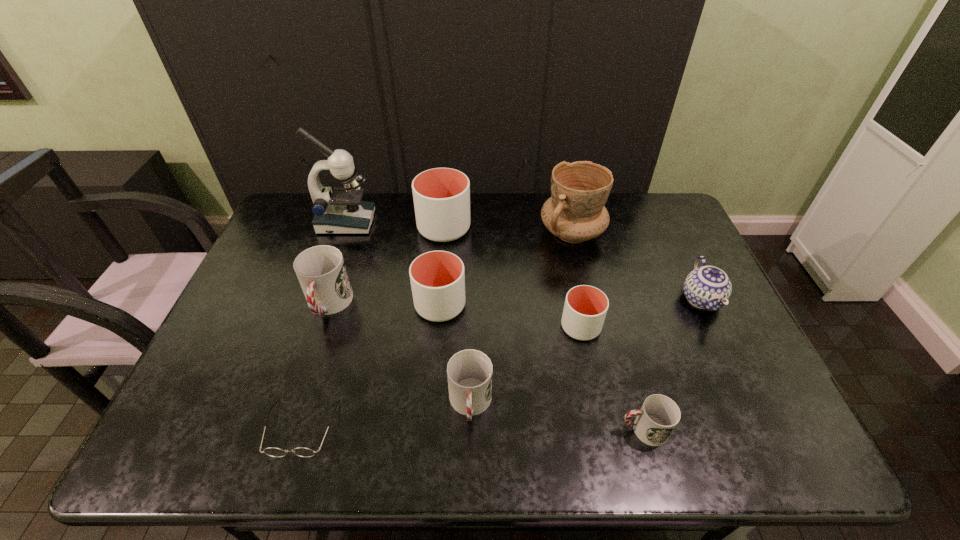
This screenshot has width=960, height=540. Identify the location of spectacles that is at the near edge. (271, 451).

Identify the location of object situated at the left edge. This screenshot has height=540, width=960. (340, 211).

This screenshot has height=540, width=960. What are the coordinates of `object located at the right edge` in the screenshot? It's located at (707, 287).

This screenshot has width=960, height=540. In order to click on object located at the far left corner in this screenshot , I will do `click(340, 211)`.

Identify the location of free space at the far edge of the desktop. This screenshot has height=540, width=960. (535, 231).

The height and width of the screenshot is (540, 960). Find the location of `vacant region at the left edge of the desktop`. vacant region at the left edge of the desktop is located at coordinates (257, 378).

In the image, there is a desktop. What are the coordinates of `vacant space at the right edge` in the screenshot? It's located at (688, 257).

Where is `free space at the far left corner of the desktop`? free space at the far left corner of the desktop is located at coordinates (296, 201).

You are a GUI agent. You are given a task and a screenshot of the screen. Output one action in this format:
    pyautogui.click(x=<x>, y=<y>)
    Task: Click on the free location at the near left corner
    
    Given the screenshot: What is the action you would take?
    pyautogui.click(x=196, y=456)

Find the location of a particular element. free spot at the near right corner of the desktop is located at coordinates tap(759, 457).